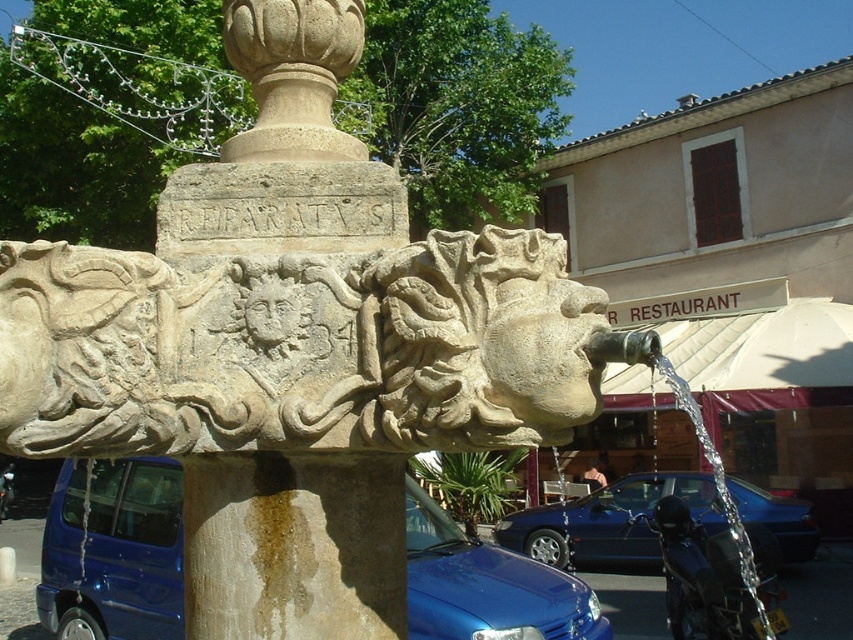
Question: In this image, where is beige stone fountain at center located relative to clear liquid water at center right?

Choices:
 (A) left
 (B) right

Answer: (A)

Question: Is beige stone fountain at center below clear liquid water at center right?

Choices:
 (A) yes
 (B) no

Answer: (B)

Question: Which object appears closest to the camera in this image?

Choices:
 (A) clear liquid water at center right
 (B) beige stone fountain at center
 (C) carved stone fountain at center
 (D) blue glossy car at center

Answer: (A)

Question: Can you confirm if metallic blue car at center is positioned to the right of blue glossy car at center?

Choices:
 (A) no
 (B) yes

Answer: (A)

Question: Estimate the real-world distances between objects in this image. Which object is farther from the beige stone fountain at center?

Choices:
 (A) metallic blue car at center
 (B) blue glossy car at center

Answer: (B)

Question: Which point appears farthest from the camera in this image?

Choices:
 (A) (641, 541)
 (B) (732, 525)
 (C) (49, 524)

Answer: (A)